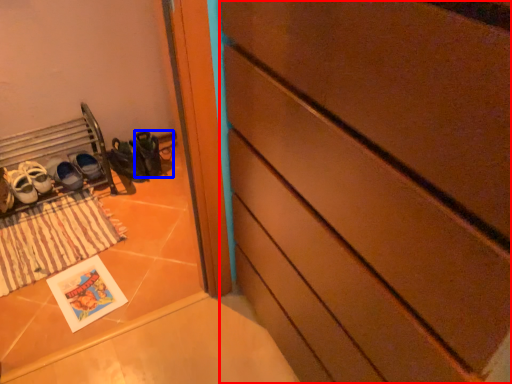
Question: Which object appears closest to the camera in this image, chest of drawers (highlighted by a red box) or shoe (highlighted by a blue box)?

Choices:
 (A) chest of drawers
 (B) shoe

Answer: (A)